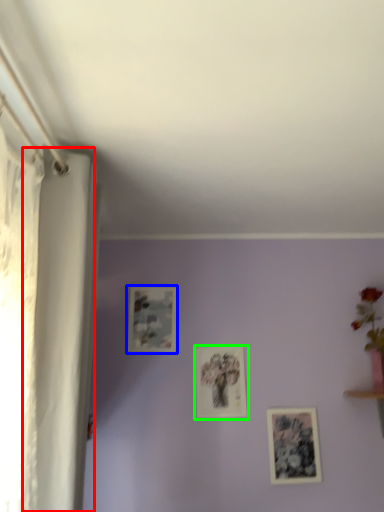
Question: Based on their relative distances, which object is farther from curtain (highlighted by a red box)? Choose from picture frame (highlighted by a blue box) and picture frame (highlighted by a green box).

Choices:
 (A) picture frame
 (B) picture frame

Answer: (B)